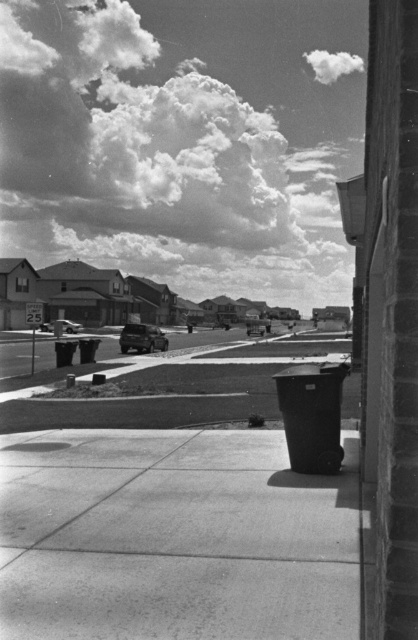
Question: Estimate the real-world distances between objects in this image. Which object is closer to the shiny silver car at center?

Choices:
 (A) shiny silver sedan at center
 (B) smooth concrete sidewalk at center

Answer: (A)

Question: Is smooth concrete sidewalk at center to the right of shiny silver car at center from the viewer's perspective?

Choices:
 (A) yes
 (B) no

Answer: (A)

Question: Estimate the real-world distances between objects in this image. Which object is closer to the smooth concrete sidewalk at center?

Choices:
 (A) shiny silver car at center
 (B) shiny silver sedan at center

Answer: (B)

Question: Can you confirm if smooth concrete sidewalk at center is bigger than shiny silver sedan at center?

Choices:
 (A) no
 (B) yes

Answer: (A)

Question: Which object appears closest to the camera in this image?

Choices:
 (A) smooth concrete sidewalk at center
 (B) shiny silver car at center
 (C) shiny silver sedan at center

Answer: (A)

Question: Can you confirm if shiny silver sedan at center is bigger than shiny silver car at center?

Choices:
 (A) no
 (B) yes

Answer: (B)